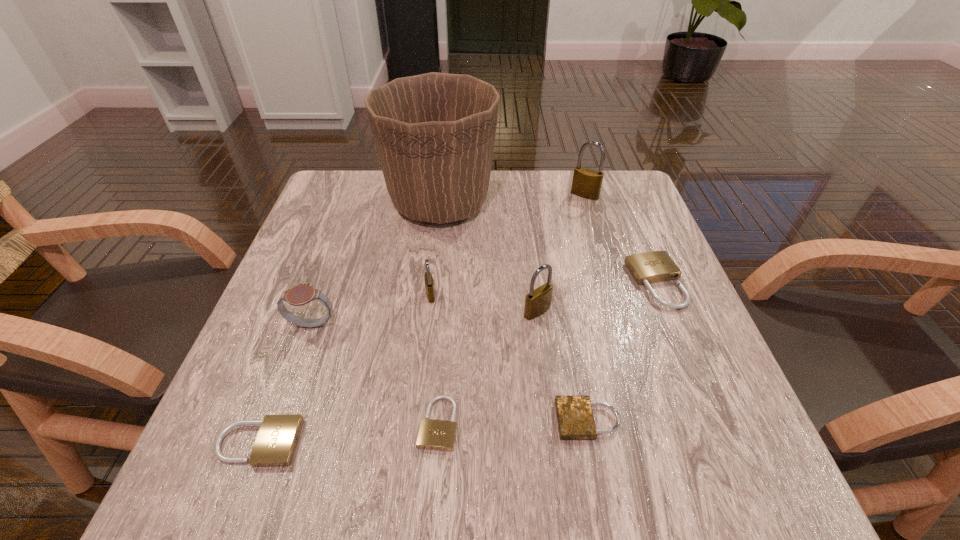
You are a GUI agent. You are given a task and a screenshot of the screen. Output one action in this format:
    pyautogui.click(x=<x>, y=<y>)
    Task: Click on the free space located 0.190m on the right of the leftmost beige padlock
    
    Given the screenshot: What is the action you would take?
    pyautogui.click(x=424, y=442)

Image resolution: width=960 pixels, height=540 pixels. What are the coordinates of `free space located on the back of the shortest object` in the screenshot? It's located at (444, 334).

The height and width of the screenshot is (540, 960). I want to click on flowerpot present at the far edge, so click(434, 133).

At what (x,y) coordinates should I click in order to perform the action: click on padlock present at the far edge. Please return your answer as a coordinate pair (x, y). This screenshot has height=540, width=960. Looking at the image, I should click on point(586,183).

You are a GUI agent. You are given a task and a screenshot of the screen. Output one action in this format:
    pyautogui.click(x=<x>, y=<y>)
    Task: Click on the watch that is at the left edge
    The image size is (960, 540).
    Given the screenshot: What is the action you would take?
    pyautogui.click(x=302, y=294)

Where is `padlock situated at the left edge`? padlock situated at the left edge is located at coordinates (276, 441).

Identify the location of object that is at the near left corner. (276, 441).

You are a GUI agent. You are given a task and a screenshot of the screen. Output one action in this format:
    pyautogui.click(x=<x>, y=<y>)
    Task: Click on the object located in the far right corner section of the desktop
    This screenshot has width=960, height=540.
    Given the screenshot: What is the action you would take?
    pyautogui.click(x=586, y=183)

The width and height of the screenshot is (960, 540). Identify the location of free space at the far edge of the desktop. (504, 190).

Locate an element on the screen. Image resolution: width=960 pixels, height=540 pixels. vacant space at the near edge of the desktop is located at coordinates (498, 496).